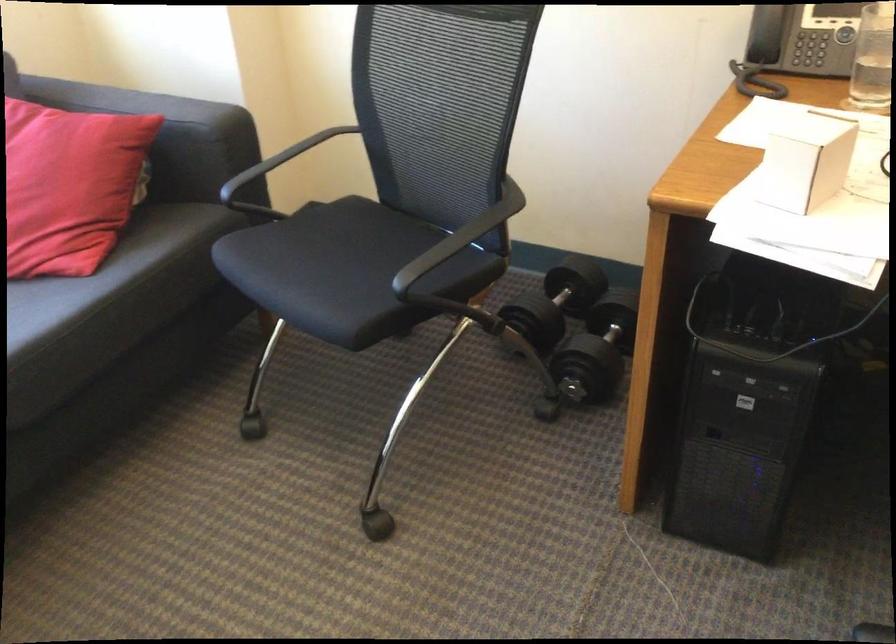
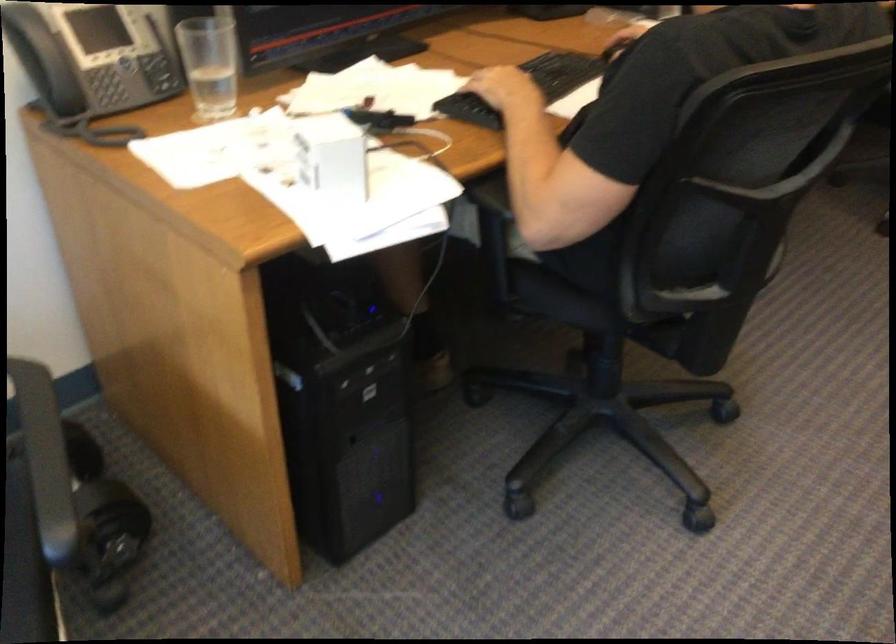
The images are taken continuously from a first-person perspective. In which direction is your viewpoint rotating?

The rotation direction of the camera is right-down.